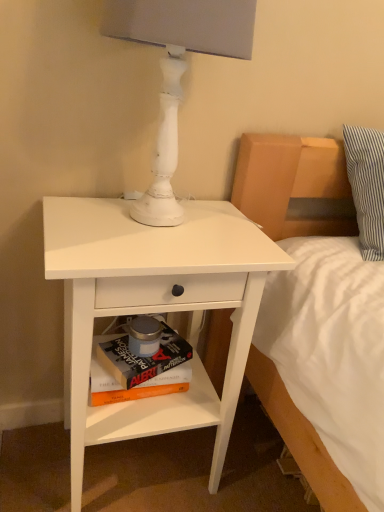
Identify the location of vacant space in front of white painted wood table lamp at upper center. (132, 254).